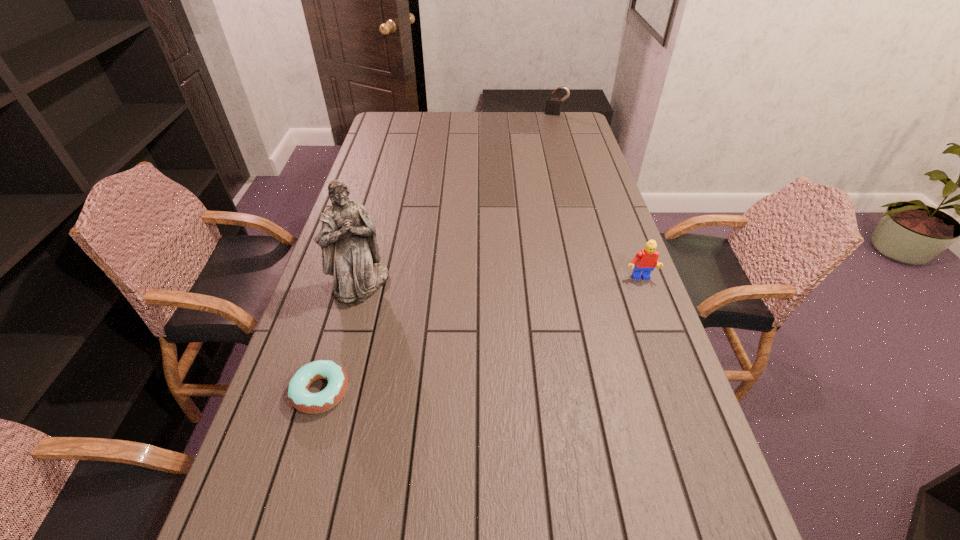
Identify the location of vacant space on the desktop that is between the doughnut and the Lego and is positioned with the keyhole on the front of the farthest object. Image resolution: width=960 pixels, height=540 pixels. (479, 335).

What are the coordinates of `vacant space on the desktop that is between the doughnut and the Lego and is positioned on the front-facing side of the figurine` in the screenshot? It's located at (460, 342).